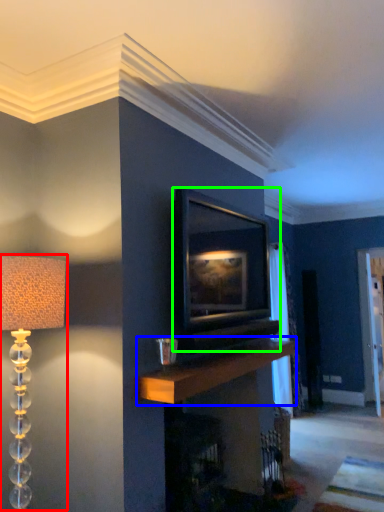
Question: Which object is the closest to the lamp (highlighted by a red box)? Choose among these: mantle (highlighted by a blue box) or picture frame (highlighted by a green box).

Choices:
 (A) mantle
 (B) picture frame

Answer: (A)